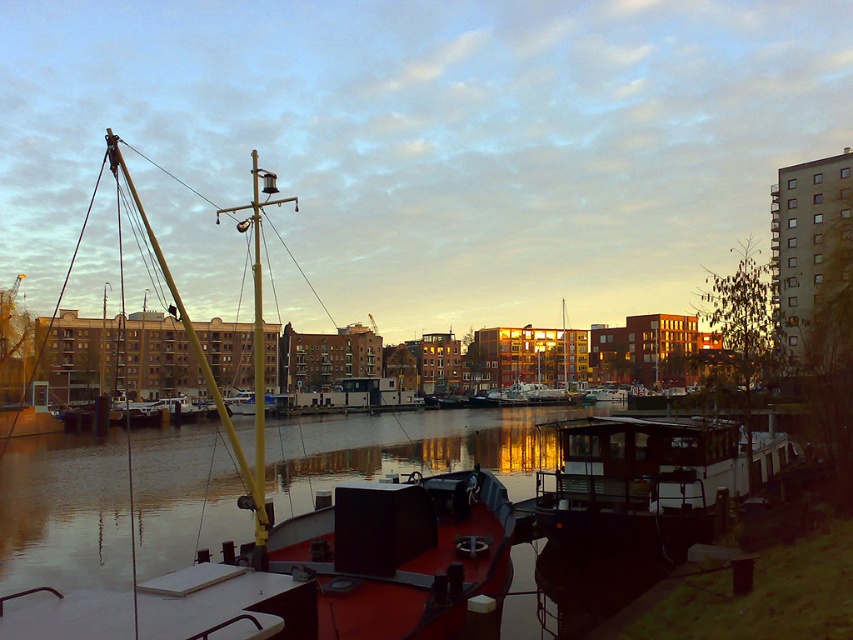
You are a photographer planning to capture the entire view of both the smooth red boat at center and the wooden cabin cruiser at center in one shot. Given that your camera has a fixed focal length and field of view, which boat should you position closer to the camera to ensure both fit within the frame?

You should position the wooden cabin cruiser at center closer to the camera because the smooth red boat at center is wider than the wooden cabin cruiser at center, so the wider boat needs to be farther back to fit both within the frame.

You are standing on the dock and see the smooth red boat at center and the wooden cabin cruiser at center in the water. Which boat is closer to the left side of the dock?

The smooth red boat at center is closer to the left side of the dock because it is positioned to the left of the wooden cabin cruiser at center.

You are a photographer planning to capture the waterfront scene. You need to determine which vessel is larger to frame your shot properly. Which is bigger between the smooth red boat at center and the wooden cabin cruiser at center?

The smooth red boat at center is bigger than the wooden cabin cruiser at center, so you should frame your shot to accommodate the larger size of the smooth red boat at center.